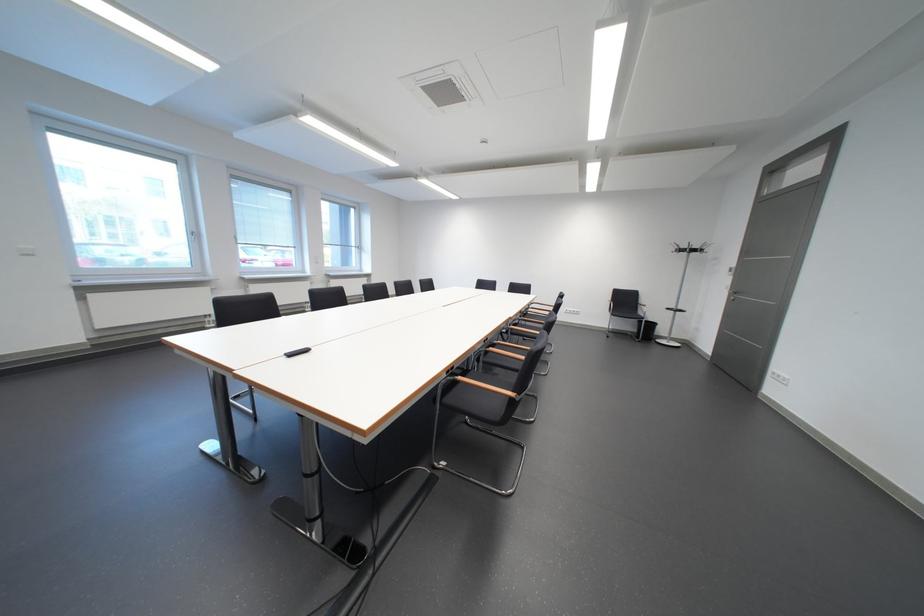
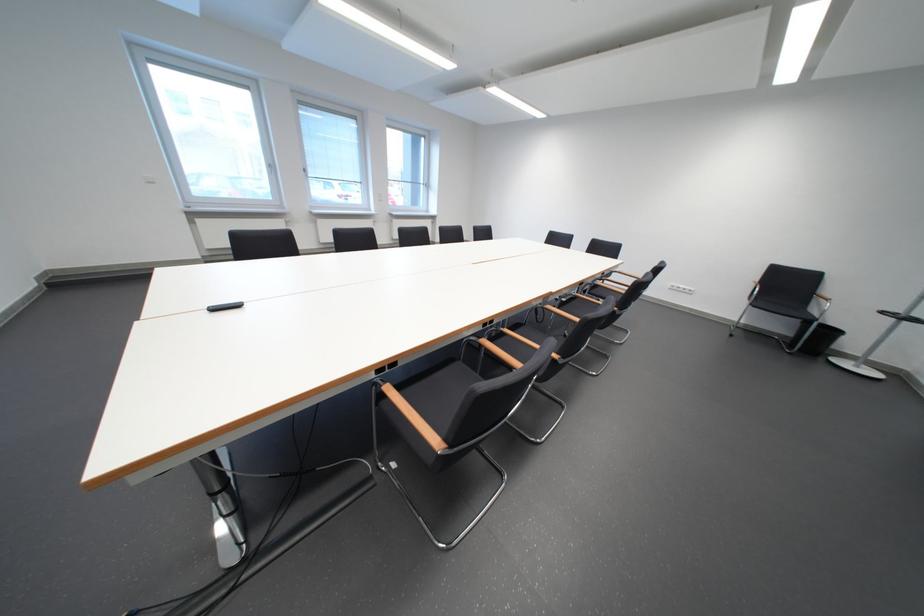
Question: The camera is either moving clockwise (left) or counter-clockwise (right) around the object. The first image is from the beginning of the video and the second image is from the end. Is the camera moving left or right when shooting the video?

Choices:
 (A) Left
 (B) Right

Answer: (B)